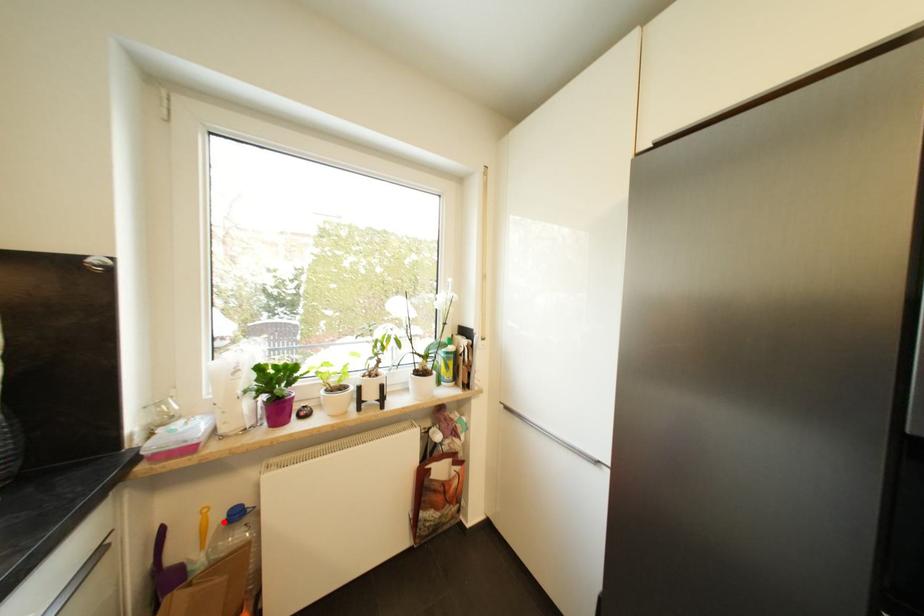
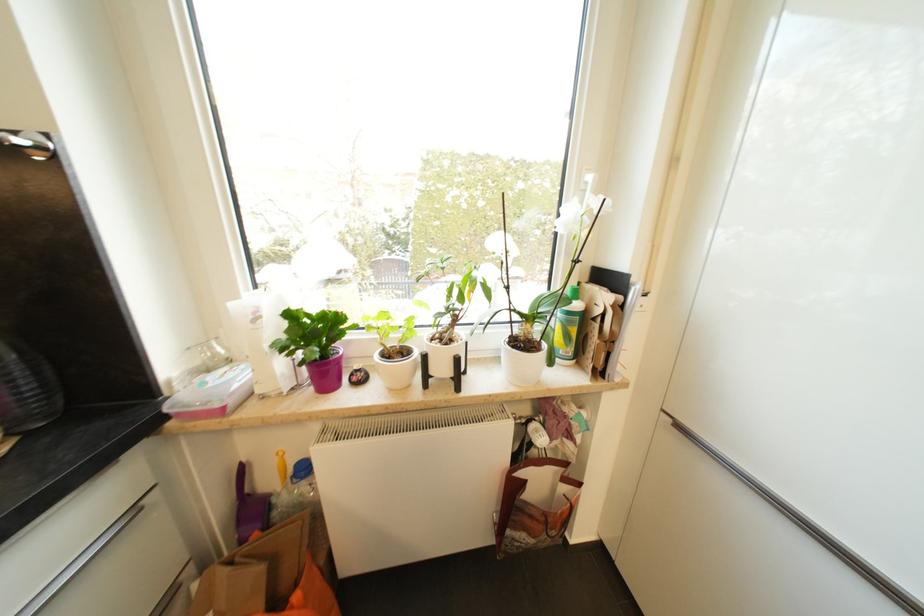
Question: A red point is marked in image1. In image2, is the corresponding 3D point closer to the camera or farther? Reply with the corresponding letter.

Choices:
 (A) The corresponding 3D point is closer.
 (B) The corresponding 3D point is farther.

Answer: (B)